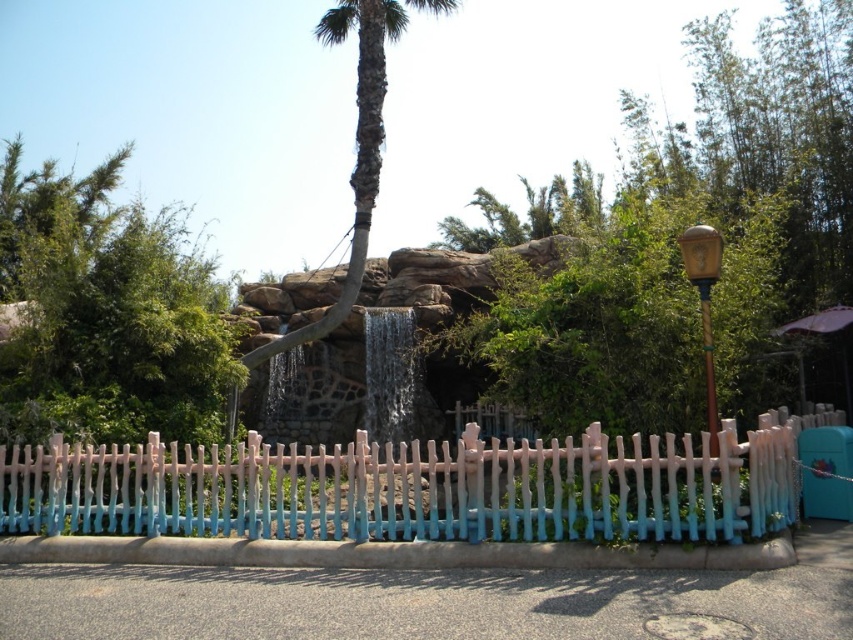
Question: Is the position of pastel wood picket fence at lower center more distant than that of green textured palm tree at center?

Choices:
 (A) yes
 (B) no

Answer: (B)

Question: Which point is farther to the camera?

Choices:
 (A) green leafy tree at upper left
 (B) pastel wood picket fence at lower center
 (C) green textured palm tree at center

Answer: (C)

Question: Considering the real-world distances, which object is farthest from the green leafy tree at upper left?

Choices:
 (A) pastel wood picket fence at lower center
 (B) green textured palm tree at center

Answer: (B)

Question: Among these objects, which one is farthest from the camera?

Choices:
 (A) pastel wood picket fence at lower center
 (B) green textured palm tree at center
 (C) green leafy tree at upper left

Answer: (B)

Question: From the image, what is the correct spatial relationship of pastel wood picket fence at lower center in relation to green textured palm tree at center?

Choices:
 (A) above
 (B) below

Answer: (B)

Question: Does pastel wood picket fence at lower center appear under green textured palm tree at center?

Choices:
 (A) yes
 (B) no

Answer: (A)